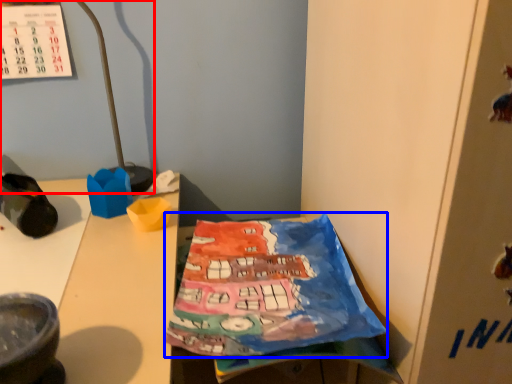
Question: Which object appears farthest to the camera in this image, lamp (highlighted by a red box) or wrapping paper (highlighted by a blue box)?

Choices:
 (A) lamp
 (B) wrapping paper

Answer: (A)